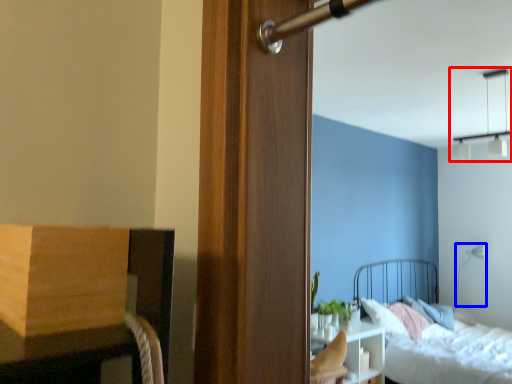
Question: Which of the following is the closest to the observer, light fixture (highlighted by a red box) or light fixture (highlighted by a blue box)?

Choices:
 (A) light fixture
 (B) light fixture

Answer: (A)